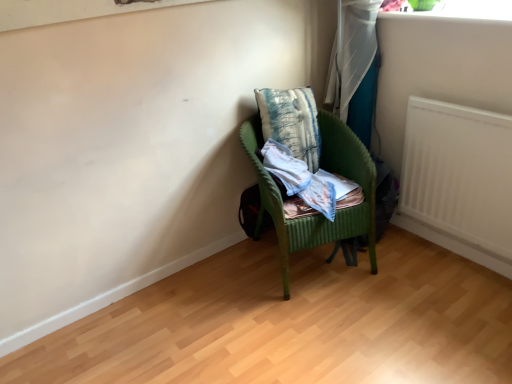
Question: Considering the positions of white fabric curtain at upper right and light blue cotton shirt at center in the image, is white fabric curtain at upper right taller or shorter than light blue cotton shirt at center?

Choices:
 (A) tall
 (B) short

Answer: (A)

Question: Considering the positions of white fabric curtain at upper right and light blue cotton shirt at center in the image, is white fabric curtain at upper right wider or thinner than light blue cotton shirt at center?

Choices:
 (A) wide
 (B) thin

Answer: (B)

Question: Which object is the closest to the white matte radiator at right?

Choices:
 (A) white fabric curtain at upper right
 (B) green wicker chair at center
 (C) textured blue pillow at center
 (D) light blue cotton shirt at center

Answer: (B)

Question: Which of these objects is positioned closest to the light blue cotton shirt at center?

Choices:
 (A) white matte radiator at right
 (B) textured blue pillow at center
 (C) white fabric curtain at upper right
 (D) green wicker chair at center

Answer: (D)